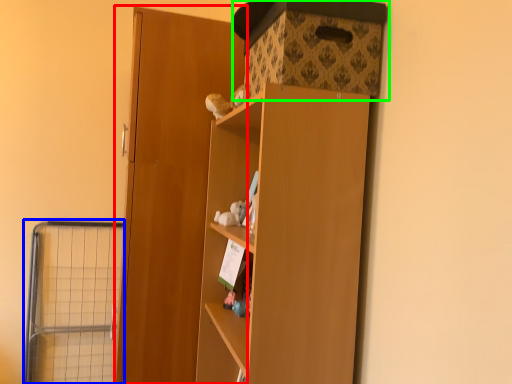
Question: Considering the real-world distances, which object is closest to door (highlighted by a red box)? cage (highlighted by a blue box) or storage box (highlighted by a green box).

Choices:
 (A) cage
 (B) storage box

Answer: (B)